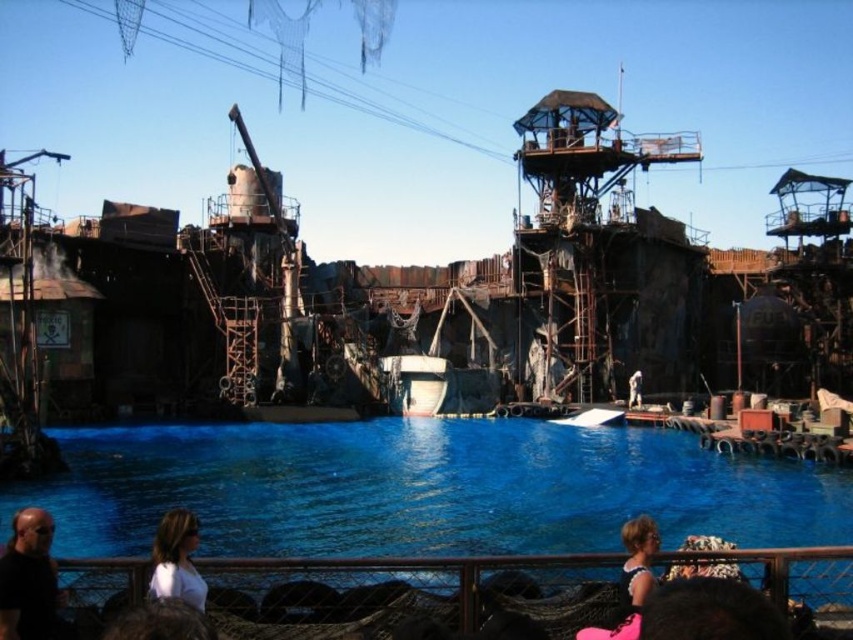
You are a photographer standing in the post apocalyptic wasteland scene. You want to take a photo of both the dark hair at lower left and the blonde hair at lower center. Which person should you focus on first to ensure they are in sharp focus?

You should focus on the dark hair at lower left first because it is closer to the viewer than the blonde hair at lower center. This ensures that the closer subject is in focus, and the background subject may still be in acceptable focus depending on the camera settings.

You are a character in a post apocalyptic movie set and you need to locate the point marked as point (28, 579). Where would you find this point?

The point (28, 579) is located on the dark hair at lower left.